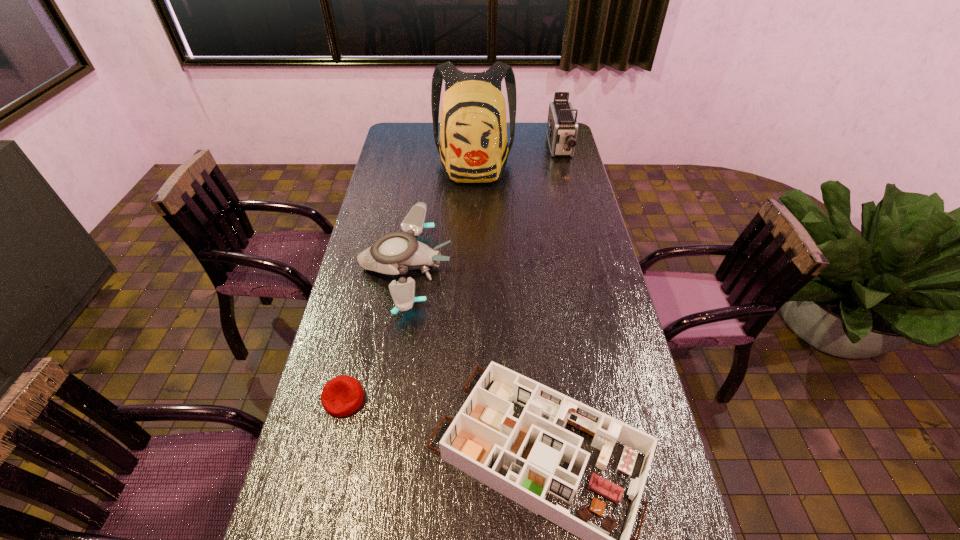
At what (x,y) coordinates should I click in order to perform the action: click on the tallest object. Please return your answer as a coordinate pair (x, y). Looking at the image, I should click on (473, 148).

The image size is (960, 540). Find the location of `camcorder`. camcorder is located at coordinates (562, 127).

Identify the location of the third nearest object. (394, 253).

The width and height of the screenshot is (960, 540). What are the coordinates of `beanbag` in the screenshot? It's located at (341, 396).

Locate an element on the screen. free region located on the front-facing side of the tallest object is located at coordinates (473, 239).

Where is `free spot located at the lens of the camcorder`? The image size is (960, 540). free spot located at the lens of the camcorder is located at coordinates (572, 199).

Locate an element on the screen. This screenshot has width=960, height=540. free space located on the front-facing side of the drone is located at coordinates pos(544,267).

The image size is (960, 540). Find the location of `vacant space located 0.130m on the seat area of the beanbag`. vacant space located 0.130m on the seat area of the beanbag is located at coordinates (327, 469).

I want to click on backpack that is positioned at the far edge, so click(x=473, y=148).

Find the location of a particular element. camcorder at the far edge is located at coordinates (562, 127).